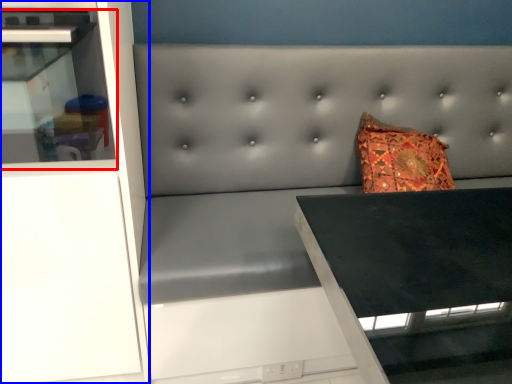
Question: Which point is further to the camera, shelf (highlighted by a red box) or cabinetry (highlighted by a blue box)?

Choices:
 (A) shelf
 (B) cabinetry

Answer: (B)